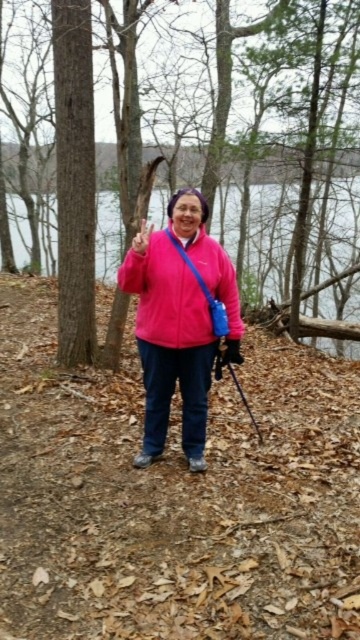
Question: Can you confirm if brown wood tree at center is positioned to the left of transparent water at center?

Choices:
 (A) no
 (B) yes

Answer: (A)

Question: Which of the following is the closest to the observer?

Choices:
 (A) matte black glove at center
 (B) brown wood tree at center
 (C) transparent water at center

Answer: (A)

Question: Which of the following is the closest to the observer?

Choices:
 (A) (176, 285)
 (B) (222, 353)
 (C) (109, 228)

Answer: (A)

Question: Does pink matte jacket at center have a lesser width compared to matte black glove at center?

Choices:
 (A) no
 (B) yes

Answer: (A)

Question: Which of the following is the closest to the observer?

Choices:
 (A) pink matte jacket at center
 (B) brown wood tree at center

Answer: (A)

Question: Does pink matte jacket at center lie in front of matte pink jacket at center?

Choices:
 (A) yes
 (B) no

Answer: (A)